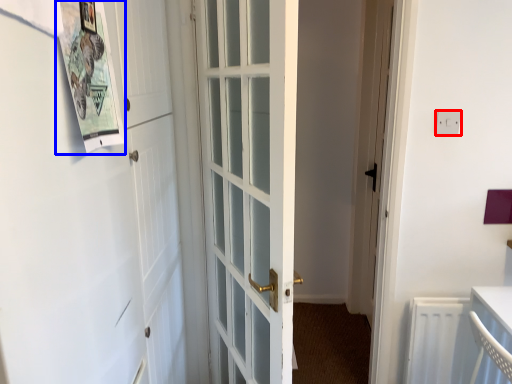
Question: Among these objects, which one is farthest to the camera, electric outlet (highlighted by a red box) or bulletin board (highlighted by a blue box)?

Choices:
 (A) electric outlet
 (B) bulletin board

Answer: (A)